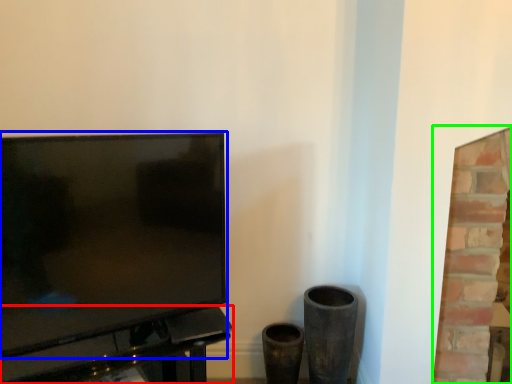
Question: Considering the real-world distances, which object is farthest from table (highlighted by a red box)? television (highlighted by a blue box) or fireplace (highlighted by a green box)?

Choices:
 (A) television
 (B) fireplace

Answer: (B)